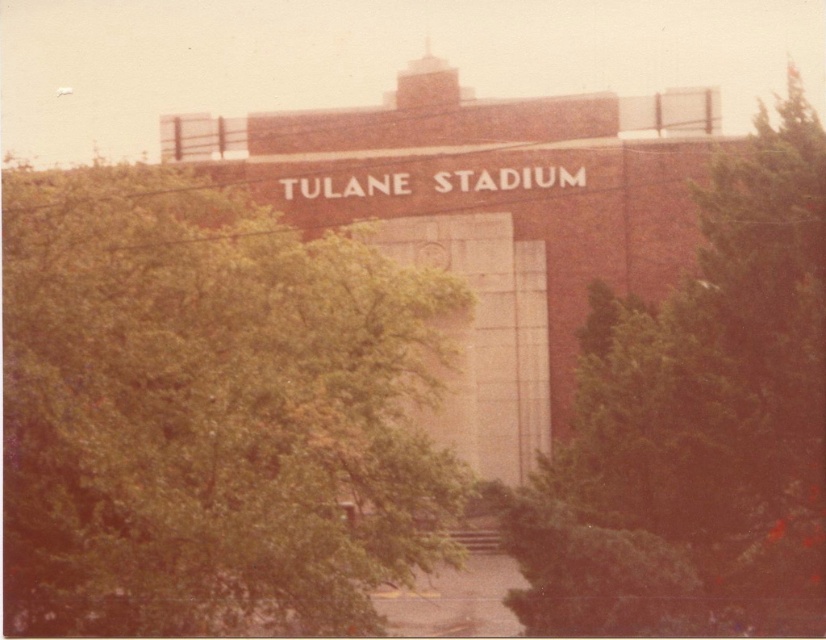
Is green leafy tree at center positioned before green leafy tree at right?

Yes, green leafy tree at center is in front of green leafy tree at right.

From the picture: Can you confirm if green leafy tree at center is positioned to the right of green leafy tree at right?

In fact, green leafy tree at center is to the left of green leafy tree at right.

Locate an element on the screen. green leafy tree at center is located at coordinates (207, 413).